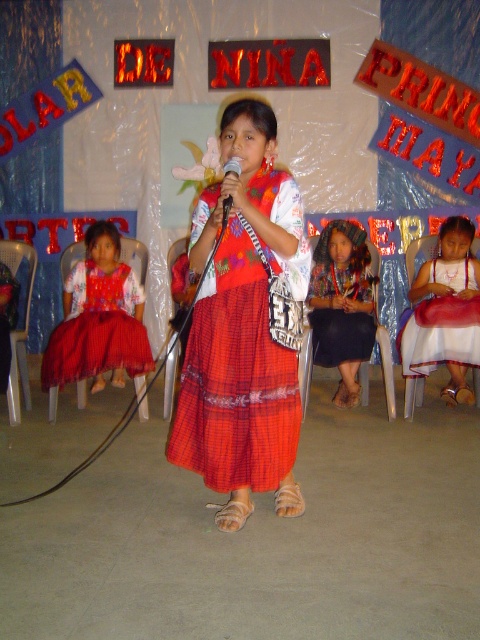
You are an event planner trying to place a decorative banner behind the girl wearing the red plaid skirt at lower left. The banner requires a 10 cm clearance on all sides. Given the stage dimensions are 2 meters wide and 1.5 meters tall, can you determine if there is enough space to place the banner around her?

The red plaid skirt at lower left is located at point (97, 326). The banner requires 10 cm clearance on all sides. The stage dimensions are 2 meters wide and 1.5 meters tall. Since the banner needs space around the skirt, and the skirt is at a specific coordinate, there should be enough space as the stage is sufficiently large. However, without knowing the banner size, it is impossible to confirm. Please provide the banner dimensions for an accurate assessment.

You are a photographer at the event and want to capture a closeup of the girl on stage. You are currently positioned at point [371,312]. There is an obstruction at point [228,168]. Can you move closer to the girl without encountering the obstruction?

Point [371,312] is further to the viewer than point [228,168], so moving towards the girl would bring you closer to point [228,168] first. Therefore, you will encounter the obstruction before reaching the girl.

You are a photographer taking a picture of the stage. You notice the textured dark blue skirt at center and the black plastic microphone at center. Which object is positioned lower in the image?

The textured dark blue skirt at center is located below the black plastic microphone at center, so it is positioned lower in the image.